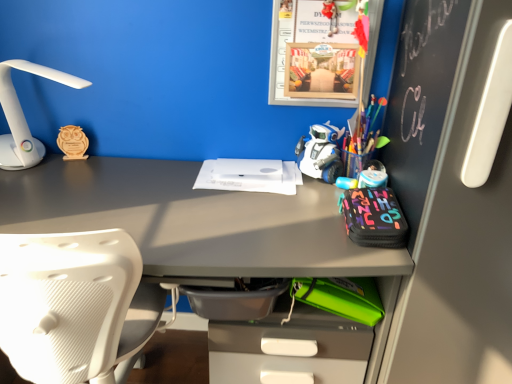
Where is `spots to the right of wooden owl at left`? spots to the right of wooden owl at left is located at coordinates (125, 168).